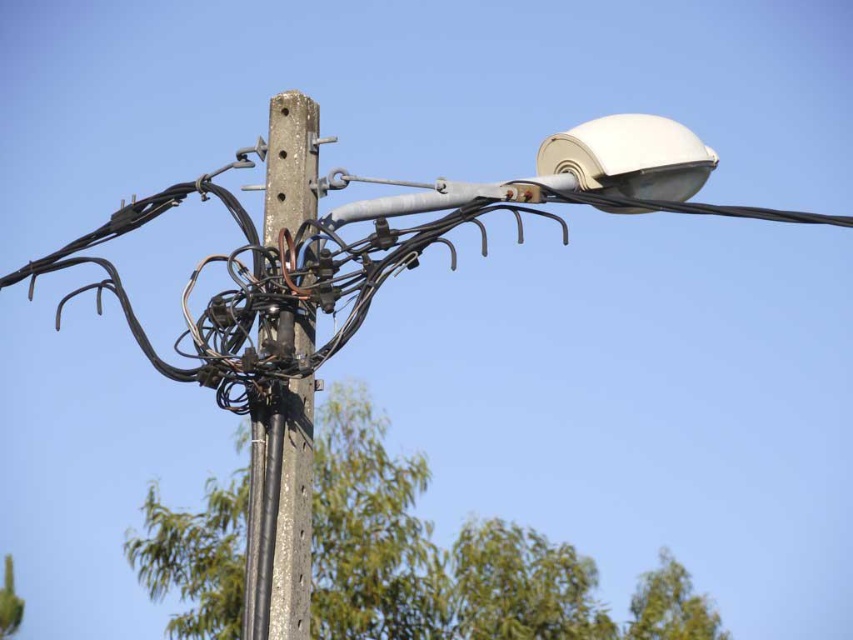
You are a bird looking for a place to perch. You see a green leafy tree at center and a gray concrete telegraph pole at center. Which one is taller?

The green leafy tree at center is taller than the gray concrete telegraph pole at center.

You are a painter needing to paint both the green leafy tree at center and the gray concrete telegraph pole at center. Which object requires more paint due to its larger width?

The green leafy tree at center requires more paint because its width is larger than the gray concrete telegraph pole at center.

You are a delivery drone with a wingspan of 1.5 meters. You need to fly from the green leafy tree at center to the gray concrete telegraph pole at center. Is there enough space between them for you to pass through without touching either?

The distance between the green leafy tree at center and the gray concrete telegraph pole at center is 11.91 meters. Since the drone has a wingspan of 1.5 meters, there is ample space for it to pass through without any issues.